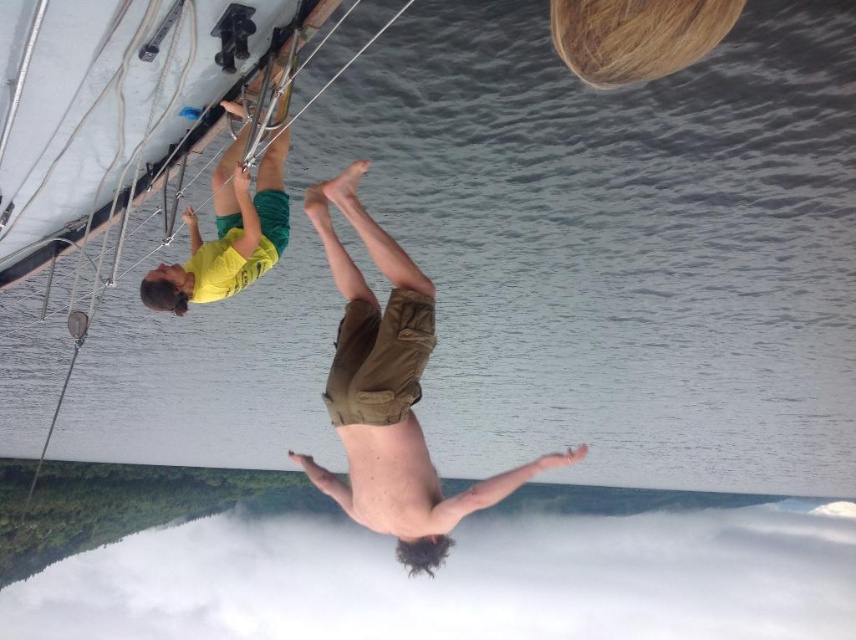
Question: Is brown cotton shorts at lower center above yellow fabric shorts at upper left?

Choices:
 (A) no
 (B) yes

Answer: (A)

Question: Among these points, which one is farthest from the camera?

Choices:
 (A) (354, 424)
 (B) (280, 140)

Answer: (B)

Question: Is brown cotton shorts at lower center above yellow fabric shorts at upper left?

Choices:
 (A) no
 (B) yes

Answer: (A)

Question: Observing the image, what is the correct spatial positioning of brown cotton shorts at lower center in reference to yellow fabric shorts at upper left?

Choices:
 (A) right
 (B) left

Answer: (A)

Question: Which point is farther to the camera?

Choices:
 (A) (409, 460)
 (B) (191, 240)

Answer: (B)